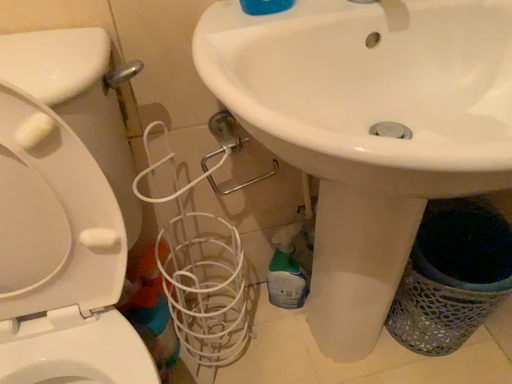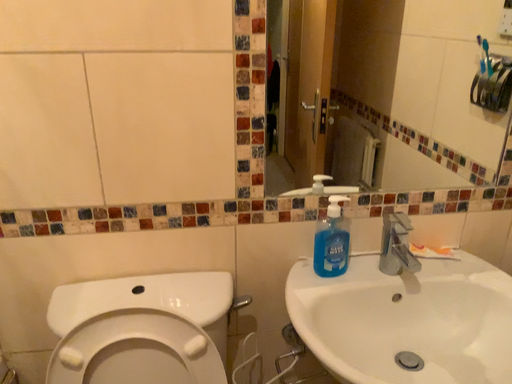
Question: How did the camera likely rotate when shooting the video?

Choices:
 (A) rotated upward
 (B) rotated downward

Answer: (A)